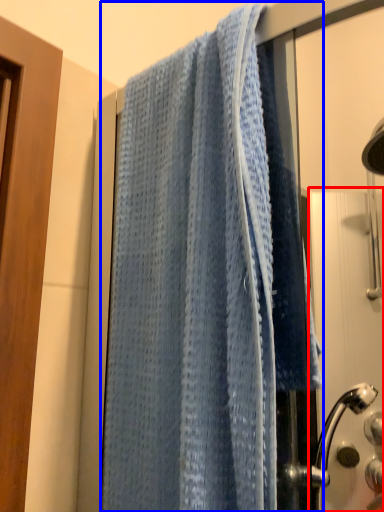
Question: Which object appears farthest to the camera in this image, screen door (highlighted by a red box) or towel (highlighted by a blue box)?

Choices:
 (A) screen door
 (B) towel

Answer: (A)